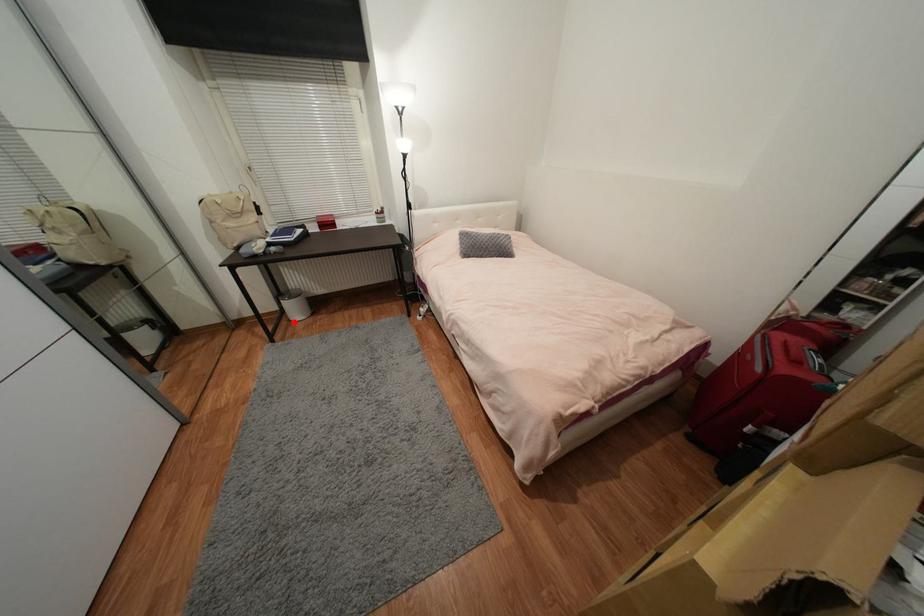
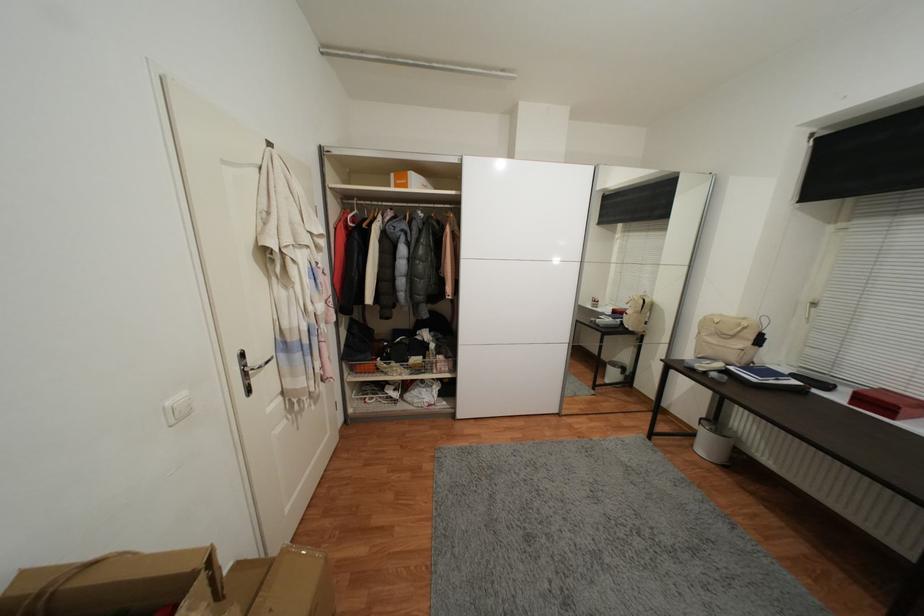
Question: I am providing you with two images of the same scene from different viewpoints. A red point is marked on the first image. Can you still see the location of the red point in image 2?

Choices:
 (A) Yes
 (B) No

Answer: (A)